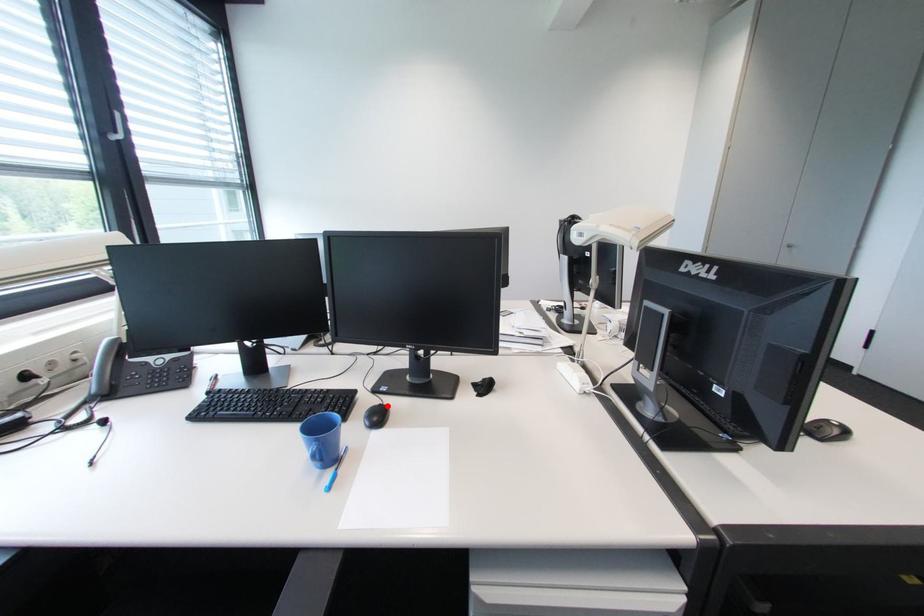
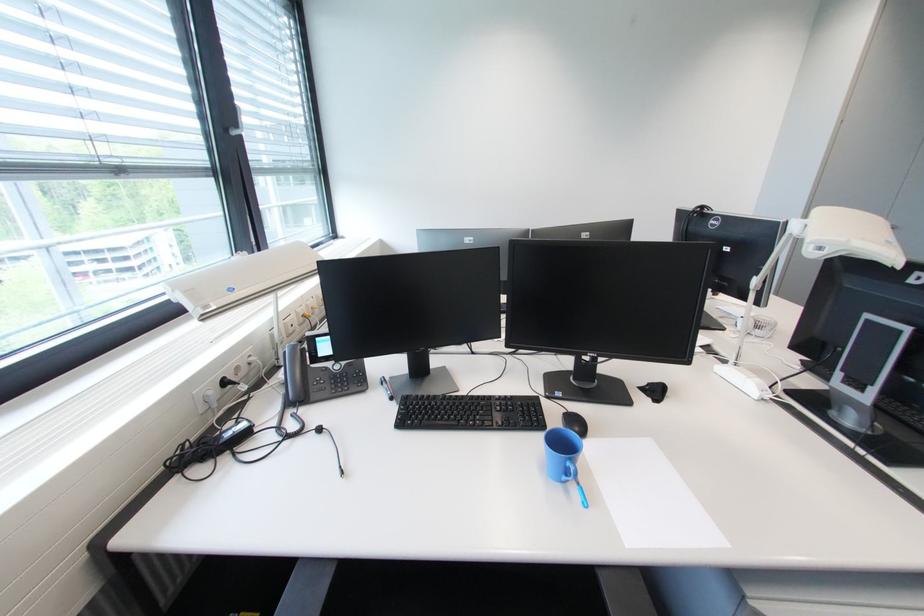
The point at the highlighted location is marked in the first image. Where is the corresponding point in the second image?

(573, 411)